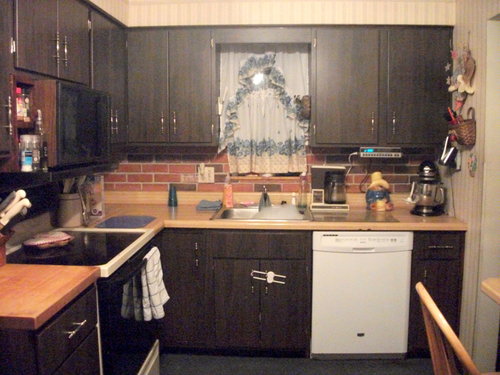
You are a GUI agent. You are given a task and a screenshot of the screen. Output one action in this format:
    pyautogui.click(x=<x>, y=<y>)
    Task: Click on the curtains
    This screenshot has width=500, height=375.
    Given the screenshot: What is the action you would take?
    pyautogui.click(x=235, y=76), pyautogui.click(x=296, y=75), pyautogui.click(x=248, y=139)